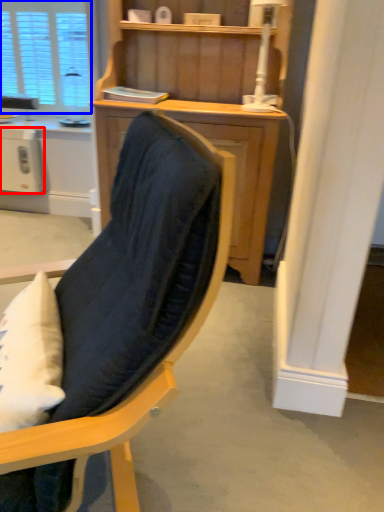
Question: Which of the following is the closest to the observer, appliance (highlighted by a red box) or window (highlighted by a blue box)?

Choices:
 (A) appliance
 (B) window

Answer: (A)